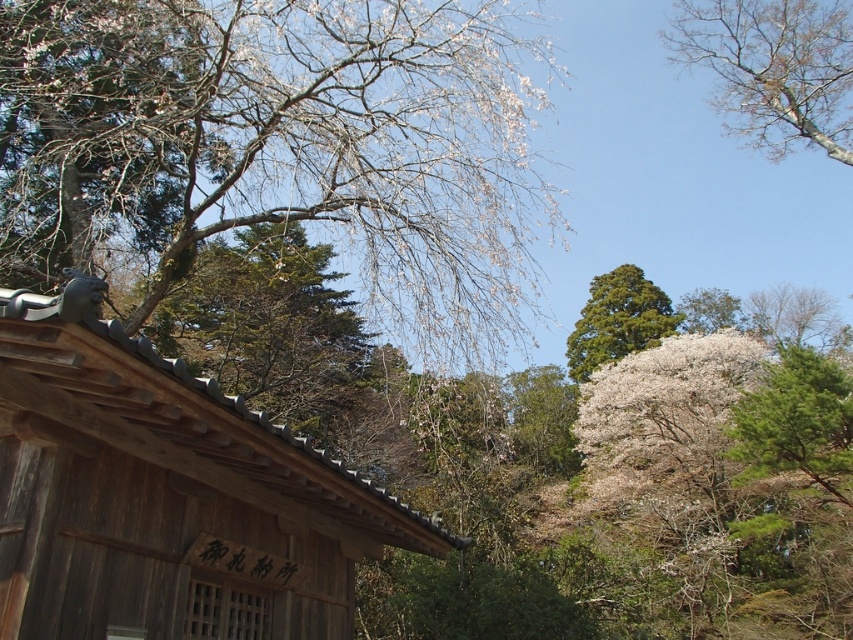
You are a visitor at a temple garden and see the bare branches at upper right and the green textured pine tree at center. Which one is positioned to the right side of the other?

The bare branches at upper right are positioned to the right of the green textured pine tree at center.

Consider the image. You are an artist sketching the scene and want to capture the thickness of the branches. Which object has thicker branches between the bare branches at upper right and the green textured pine tree at center?

The green textured pine tree at center has thicker branches than the bare branches at upper right.